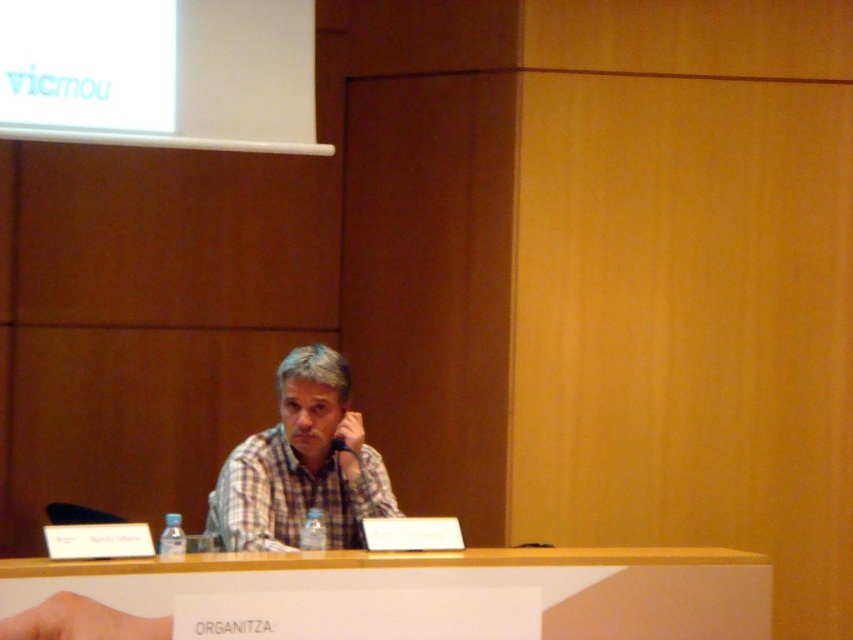
Question: Does white wood table at center appear under plaid fabric shirt at center?

Choices:
 (A) yes
 (B) no

Answer: (A)

Question: Can you confirm if white wood table at center is smaller than plaid fabric shirt at center?

Choices:
 (A) yes
 (B) no

Answer: (B)

Question: Which of the following is the farthest from the observer?

Choices:
 (A) white wood table at center
 (B) plaid fabric shirt at center

Answer: (B)

Question: Is white wood table at center closer to the viewer compared to plaid fabric shirt at center?

Choices:
 (A) no
 (B) yes

Answer: (B)